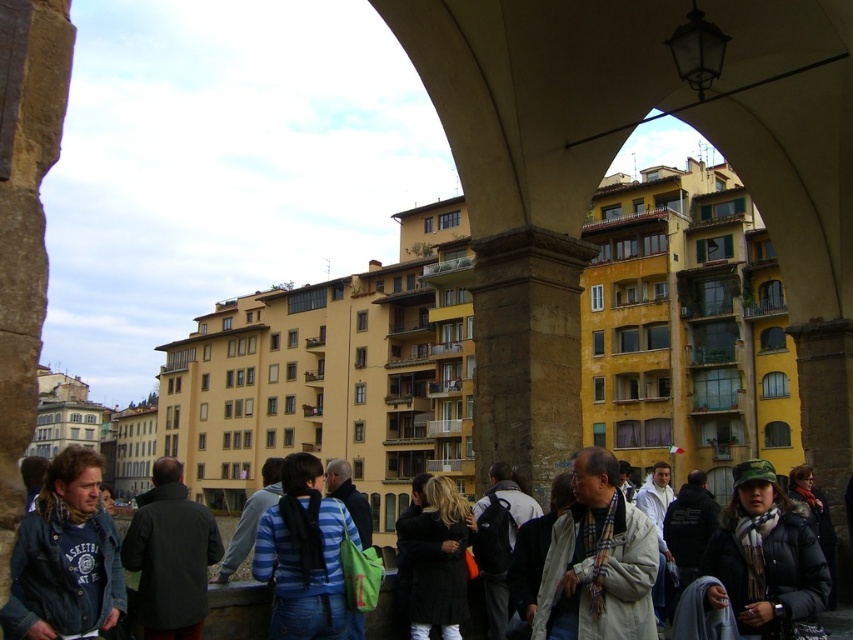
In the scene shown: You are a photographer trying to capture a shot of the denim jacket at lower left and the dark gray backpack at center. Since you want both items to appear equally prominent in the photo, which object should you move closer to, and which should you move farther away?

To make both the denim jacket at lower left and the dark gray backpack at center appear equally prominent, you should move closer to the denim jacket at lower left and move farther away from the dark gray backpack at center. This adjustment compensates for the denim jacket being larger in size compared to the backpack, balancing their visual prominence in the photo.

You are a tour guide leading a group through this historical area. You notice a denim jacket at lower left and a white wool scarf at lower right. Can you determine if there is enough space between them for a 12 feet wide tour cart to pass through?

The denim jacket at lower left and white wool scarf at lower right are 44.59 feet apart from each other, so yes, the tour cart can pass through the space between them since the distance is greater than the cart width.

You are a photographer trying to capture both the striped cotton shirt at center and the white wool scarf at lower right in the same frame. Based on their positions, which object should you adjust your camera to focus on first to ensure both are in the shot?

The striped cotton shirt at center is to the left of the white wool scarf at lower right, so you should focus on the white wool scarf at lower right first to ensure both are captured in the frame.